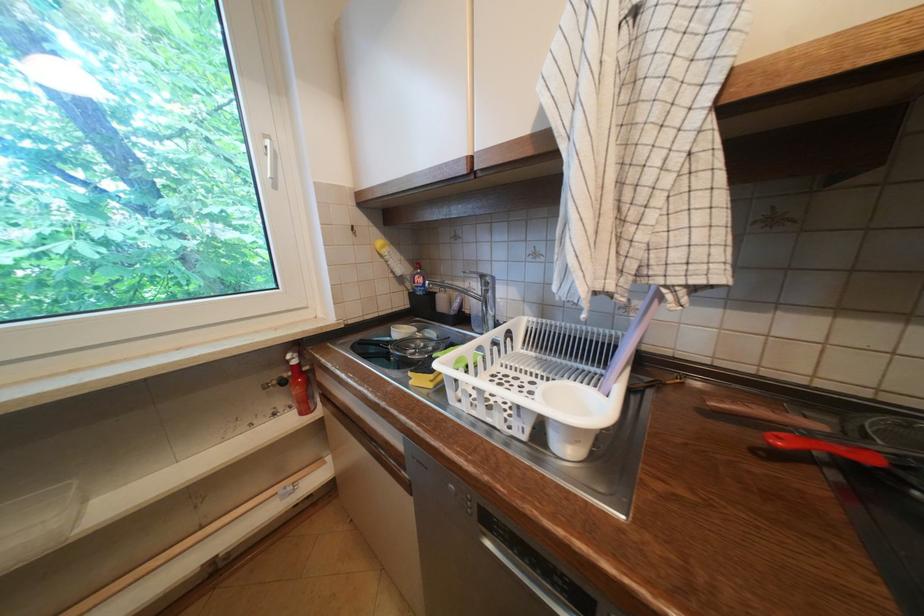
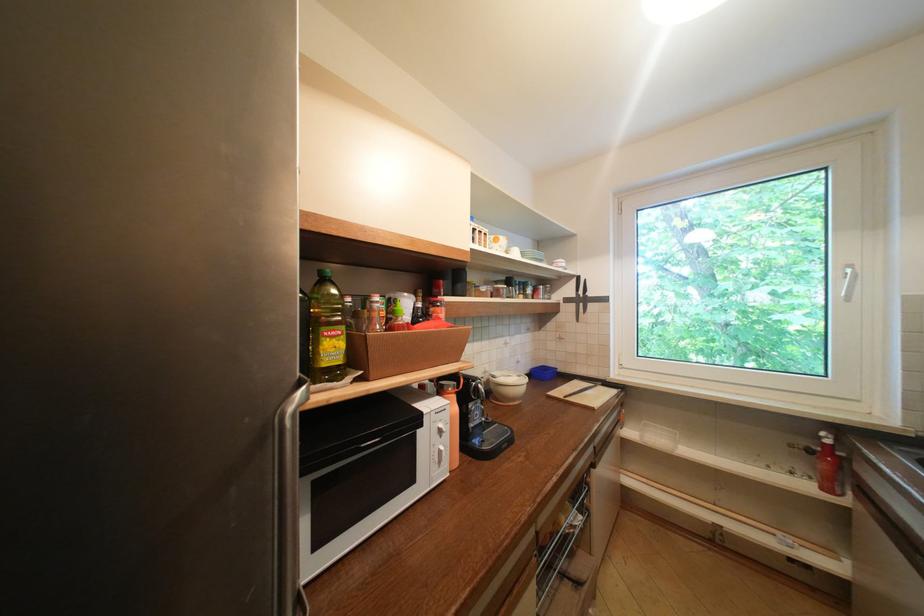
Where in the second image is the point corresponding to the point at 274,156 from the first image?

(854, 280)